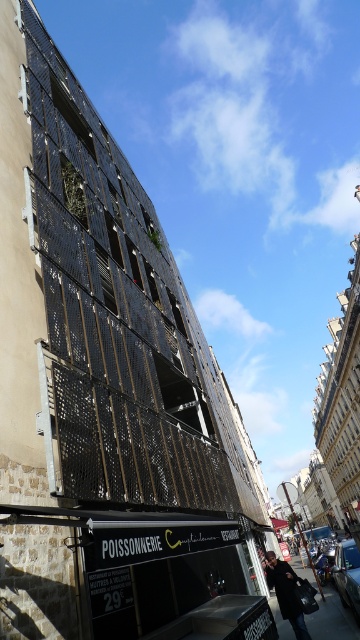
Question: Based on their relative distances, which object is farther from the black perforated metal scaffolding at left?

Choices:
 (A) dark brown leather coat at lower right
 (B) metallic mesh construction at lower right

Answer: (B)

Question: Is black perforated metal scaffolding at left smaller than metallic mesh construction at lower right?

Choices:
 (A) yes
 (B) no

Answer: (B)

Question: Which object is the farthest from the metallic mesh construction at lower right?

Choices:
 (A) dark brown leather coat at lower right
 (B) black perforated metal scaffolding at left

Answer: (B)

Question: Is black perforated metal scaffolding at left wider than metallic mesh construction at lower right?

Choices:
 (A) no
 (B) yes

Answer: (B)

Question: Is metallic mesh construction at lower right in front of dark brown leather coat at lower right?

Choices:
 (A) yes
 (B) no

Answer: (A)

Question: Which object is farther from the camera taking this photo?

Choices:
 (A) dark brown leather coat at lower right
 (B) metallic mesh construction at lower right

Answer: (A)